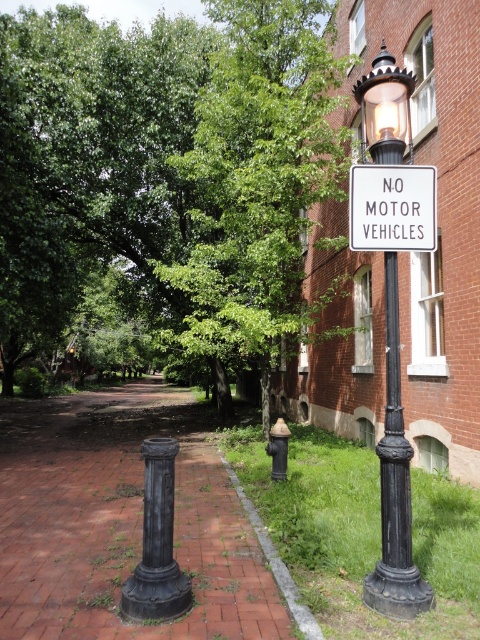
Is green leafy tree at upper center taller than matte black lamp post at upper center?

In fact, green leafy tree at upper center may be shorter than matte black lamp post at upper center.

From the picture: Is green leafy tree at upper center smaller than matte black lamp post at upper center?

Yes.

Is point (307, 8) positioned after point (394, 147)?

Yes, it is.

Locate an element on the screen. green leafy tree at upper center is located at coordinates (259, 180).

Is black wrought iron lamp post at center right to the left of white plastic sign at upper center from the viewer's perspective?

In fact, black wrought iron lamp post at center right is to the right of white plastic sign at upper center.

Who is taller, black wrought iron lamp post at center right or white plastic sign at upper center?

black wrought iron lamp post at center right is taller.

Between point (396, 176) and point (362, 211), which one is positioned behind?

The point (362, 211) is behind.

Where is `black wrought iron lamp post at center right`? This screenshot has height=640, width=480. black wrought iron lamp post at center right is located at coordinates (392, 308).

Who is shorter, black wrought iron lamp post at center right or matte black lamp post at upper center?

Standing shorter between the two is matte black lamp post at upper center.

Does black wrought iron lamp post at center right lie in front of matte black lamp post at upper center?

Yes, black wrought iron lamp post at center right is in front of matte black lamp post at upper center.

Who is more distant from viewer, (371,200) or (365,113)?

Point (365,113)

Where is `black wrought iron lamp post at center right`? This screenshot has height=640, width=480. black wrought iron lamp post at center right is located at coordinates (392, 308).